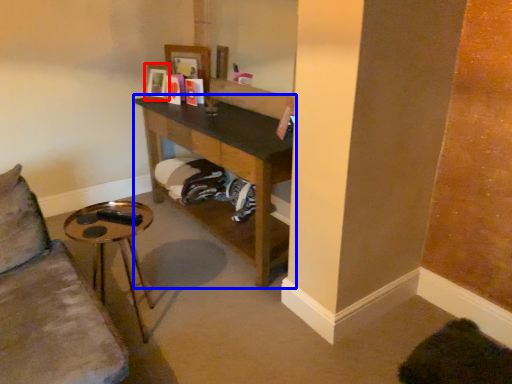
Question: Among these objects, which one is farthest to the camera, picture frame (highlighted by a red box) or shelf (highlighted by a blue box)?

Choices:
 (A) picture frame
 (B) shelf

Answer: (A)